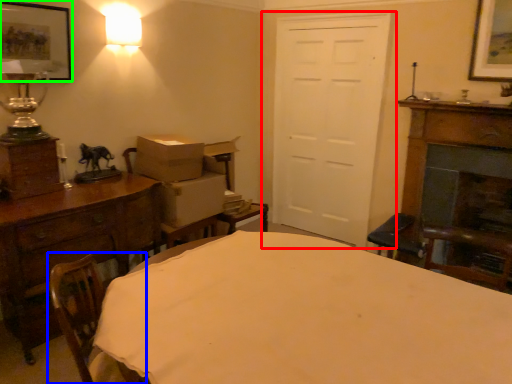
Question: Estimate the real-world distances between objects in this image. Which object is farther from door (highlighted by a red box), swivel chair (highlighted by a blue box) or picture frame (highlighted by a green box)?

Choices:
 (A) swivel chair
 (B) picture frame

Answer: (A)